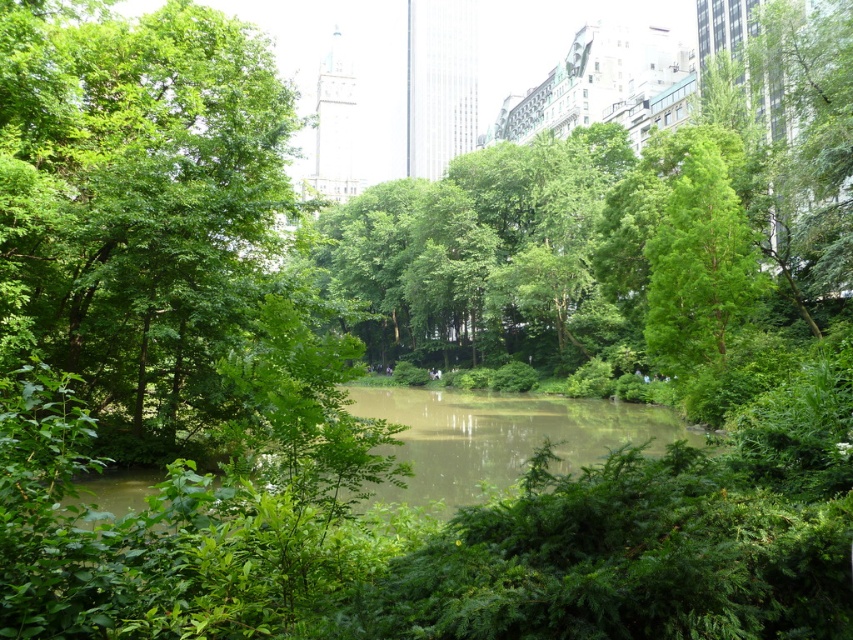
You are standing in the park and want to take a photo of both the point at coordinates point [93,371] and the point at coordinates point [643,225]. Which point is closer to you?

Point [93,371] is closer to the camera than point [643,225], so it will be closer to you.

You are standing at the center of the park and want to take a photo of the green leafy tree at center. Which direction should you face to ensure the tree is in the frame?

You should face north because the green leafy tree at center is located at point (137, 204), which is to the north of your current position at the park center.

You are standing at point [137,204] in the park. What can you see around you?

At point [137,204], there is a green leafy tree at center.